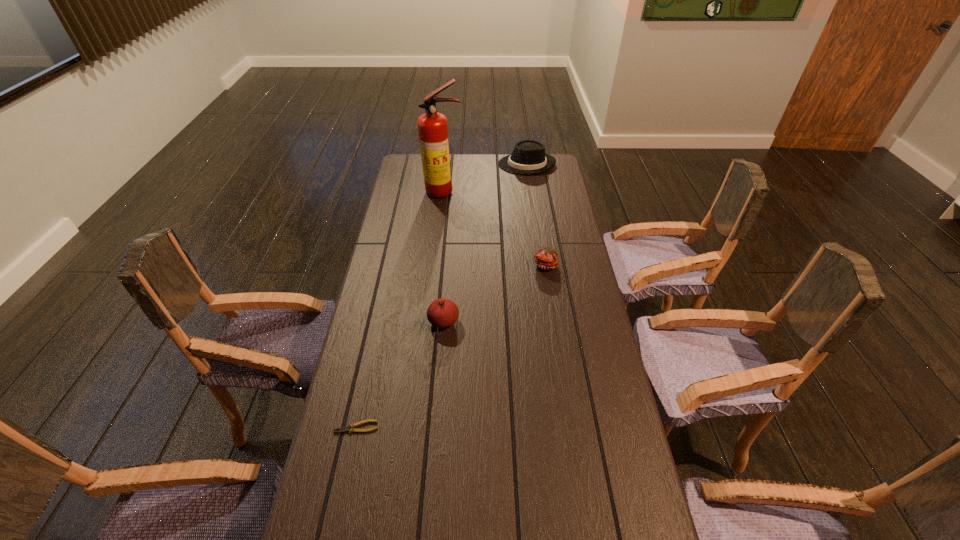
This screenshot has height=540, width=960. Identify the location of empty space that is in between the fire extinguisher and the second nearest object. (444, 256).

The width and height of the screenshot is (960, 540). Find the location of `unoccupied position between the shortest object and the tallest object`. unoccupied position between the shortest object and the tallest object is located at coordinates (400, 309).

Where is `vacant area between the pliers and the fedora`? The width and height of the screenshot is (960, 540). vacant area between the pliers and the fedora is located at coordinates (442, 296).

I want to click on vacant point located between the fedora and the shortest object, so [442, 296].

I want to click on vacant space in between the farther tomato and the fire extinguisher, so click(495, 228).

At what (x,y) coordinates should I click in order to perform the action: click on object that is the third closest to the nearer tomato. Please return your answer as a coordinate pair (x, y). This screenshot has width=960, height=540. Looking at the image, I should click on (432, 126).

The image size is (960, 540). Identify the location of object that is the fourth closest one to the farthest object. (345, 428).

Identify the location of vacant area that satisfies the following two spatial constraints: 1. on the front-facing side of the farthest object; 2. on the front-facing side of the fire extinguisher. (531, 192).

Where is `free space that satisfies the following two spatial constraints: 1. on the front-facing side of the tallest object; 2. on the right side of the nearer tomato`? free space that satisfies the following two spatial constraints: 1. on the front-facing side of the tallest object; 2. on the right side of the nearer tomato is located at coordinates (430, 321).